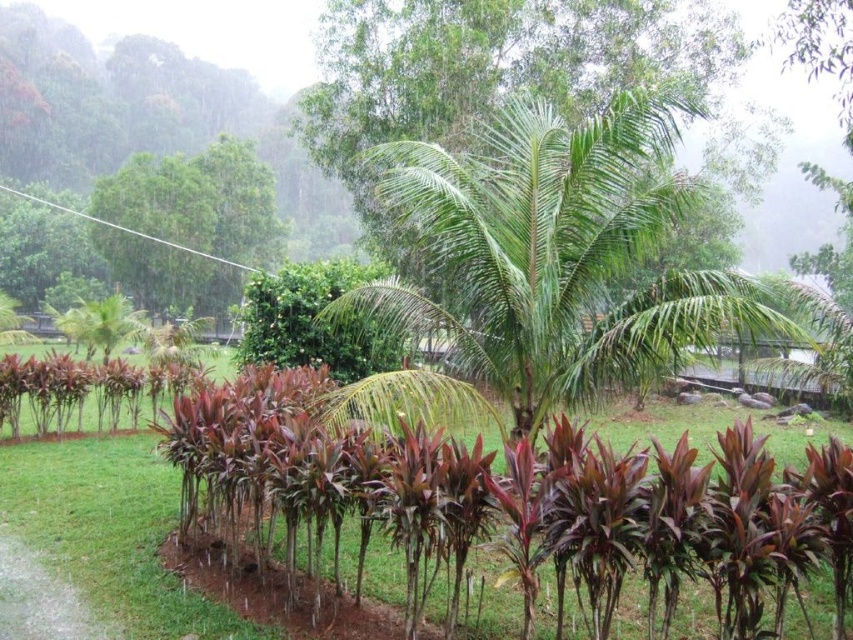
Question: Which of the following is the closest to the observer?

Choices:
 (A) green leafy palm at center
 (B) purple-leaved plants at center

Answer: (A)

Question: Is green leafy palm at center to the right of purple-leaved plants at center from the viewer's perspective?

Choices:
 (A) no
 (B) yes

Answer: (B)

Question: Is green leafy palm at center positioned in front of purple-leaved plants at center?

Choices:
 (A) yes
 (B) no

Answer: (A)

Question: Which of the following is the closest to the observer?

Choices:
 (A) (752, 529)
 (B) (788, 337)

Answer: (A)

Question: Can you confirm if green leafy palm at center is positioned below purple-leaved plants at center?

Choices:
 (A) no
 (B) yes

Answer: (A)

Question: Which point is closer to the camera taking this photo?

Choices:
 (A) (734, 573)
 (B) (407, 205)

Answer: (A)